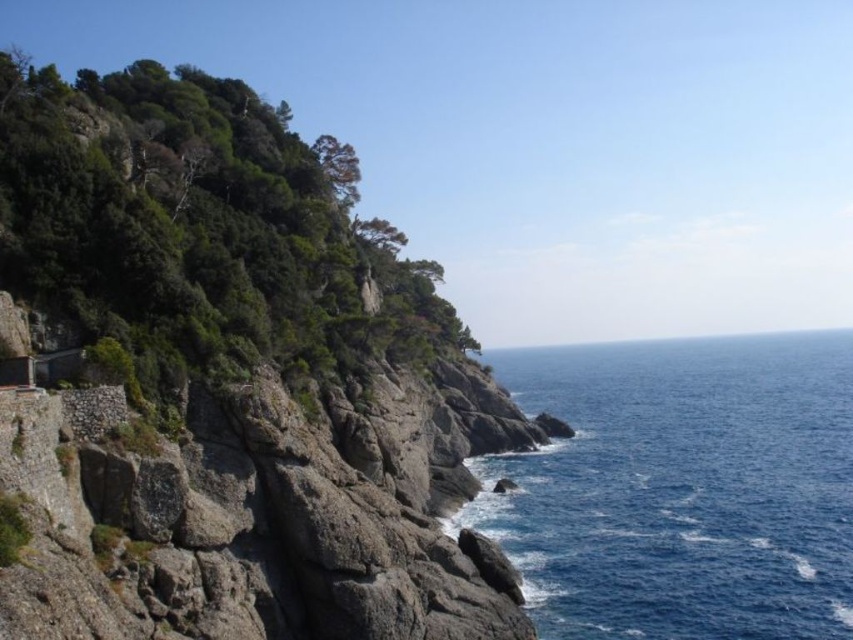
You are a hiker planning to cross from the green leafy hillside at upper left to the blue water at right. Given that the path between them is narrow, can you safely walk through the area between them?

The green leafy hillside at upper left is thinner than the blue water at right, so the path between them is narrow but still passable for a hiker.

You are standing on the cliff and want to take a photo of the green leafy hillside at upper left and the blue water at right. Which object will appear larger in the photo?

The green leafy hillside at upper left will appear larger in the photo because it is closer to the viewer than the blue water at right.